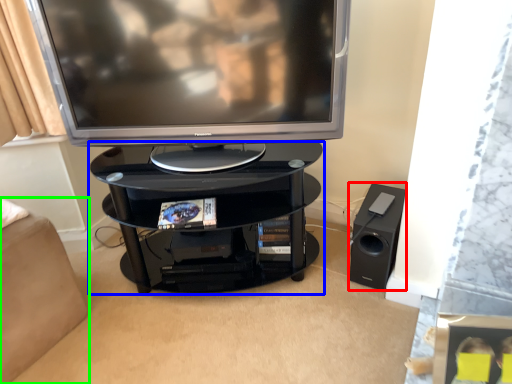
Question: Estimate the real-world distances between objects in this image. Which object is farther from speaker (highlighted by a red box), shelf (highlighted by a blue box) or furniture (highlighted by a green box)?

Choices:
 (A) shelf
 (B) furniture

Answer: (B)